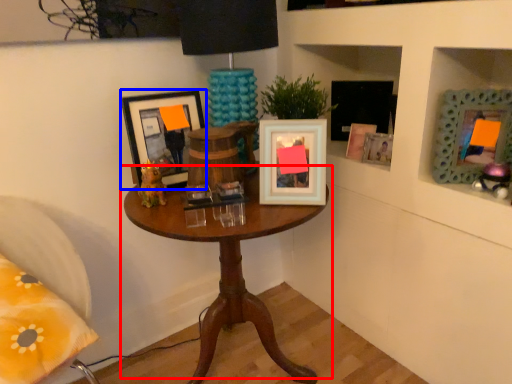
Question: Among these objects, which one is nearest to the camera, table (highlighted by a red box) or picture frame (highlighted by a blue box)?

Choices:
 (A) table
 (B) picture frame

Answer: (A)